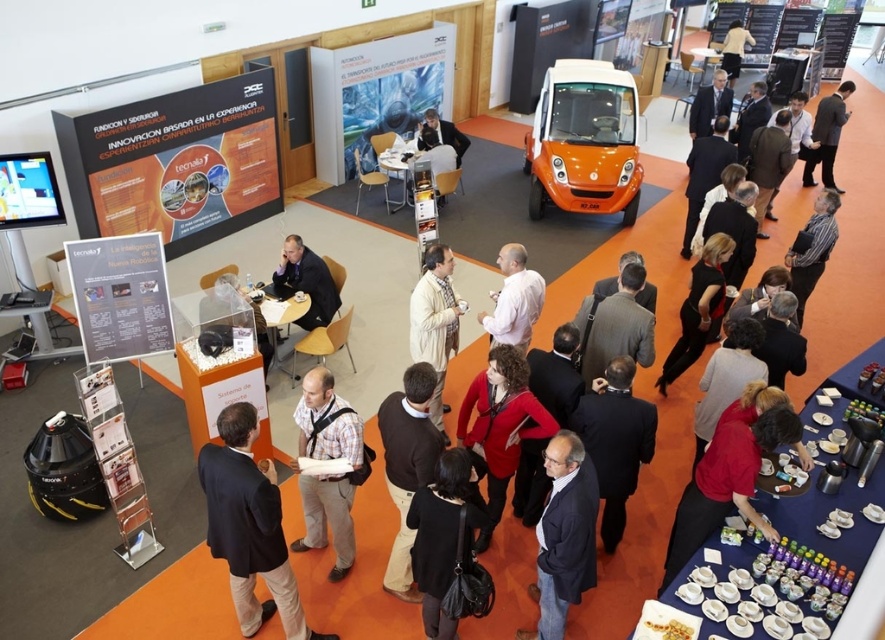
In the scene shown: Does brown sweater at center have a smaller size compared to white shirt at center?

Actually, brown sweater at center might be larger than white shirt at center.

What do you see at coordinates (406, 465) in the screenshot? I see `brown sweater at center` at bounding box center [406, 465].

Where is `brown sweater at center`? This screenshot has width=885, height=640. brown sweater at center is located at coordinates (406, 465).

Is brown sweater at center thinner than striped shirt at center?

Indeed, brown sweater at center has a lesser width compared to striped shirt at center.

Does brown sweater at center appear over striped shirt at center?

No, brown sweater at center is not above striped shirt at center.

At what (x,y) coordinates should I click in order to perform the action: click on brown sweater at center. Please return your answer as a coordinate pair (x, y). Looking at the image, I should click on (406, 465).

Can you confirm if brown sweater at center is wider than light beige shirt at upper center?

In fact, brown sweater at center might be narrower than light beige shirt at upper center.

Which of these two, brown sweater at center or light beige shirt at upper center, stands taller?

brown sweater at center is taller.

What are the coordinates of `brown sweater at center` in the screenshot? It's located at coord(406,465).

At what (x,y) coordinates should I click in order to perform the action: click on brown sweater at center. Please return your answer as a coordinate pair (x, y). This screenshot has width=885, height=640. Looking at the image, I should click on (406, 465).